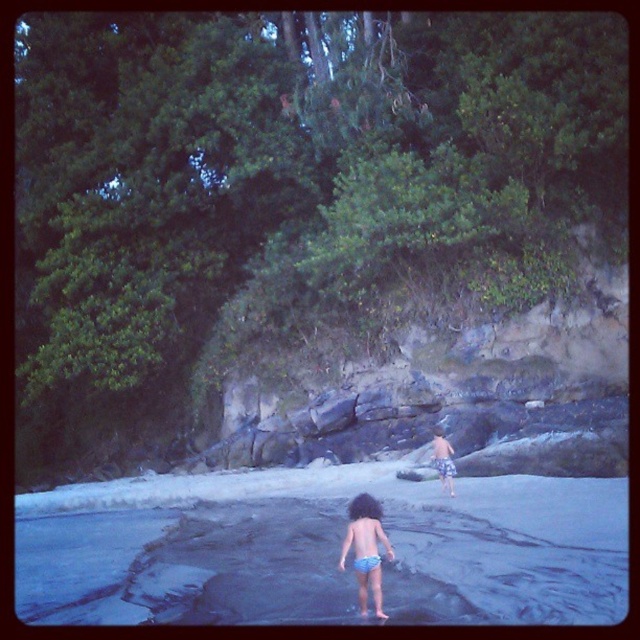
You are standing on the beach and see the blue rubber water at center. Where exactly is it located in terms of coordinates?

The blue rubber water at center is located at coordinates point (321, 548).

You are standing on the beach and see a point marked at coordinates (365, 548). What object is located at that point?

The point at coordinates (365, 548) corresponds to blue denim shorts at center.

You are standing on the beach and want to reach the point marked at coordinates (468,500). The rocks nearby are 12 meters away from you. Can you walk directly to the point without going around the rocks?

The point marked at coordinates (468,500) is 11.55 meters away from you, which is closer than the rocks that are 12 meters away. Therefore, you can walk directly to the point without needing to go around the rocks.